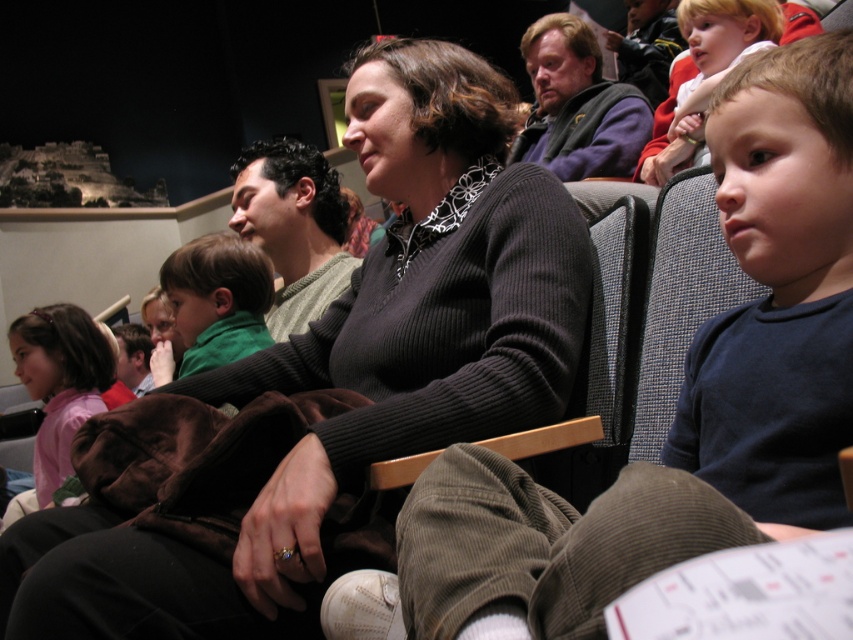
Based on the photo, is black ribbed sweater at center to the left of blonde hair child at center from the viewer's perspective?

Indeed, black ribbed sweater at center is positioned on the left side of blonde hair child at center.

Does black ribbed sweater at center have a larger size compared to blonde hair child at center?

Yes, black ribbed sweater at center is bigger than blonde hair child at center.

The height and width of the screenshot is (640, 853). In order to click on black ribbed sweater at center in this screenshot , I will do `click(352, 368)`.

Is pink fabric shirt at lower left positioned in front of blonde hair child at center?

No, pink fabric shirt at lower left is behind blonde hair child at center.

Is pink fabric shirt at lower left to the left of blonde hair child at center from the viewer's perspective?

Yes, pink fabric shirt at lower left is to the left of blonde hair child at center.

Measure the distance between pink fabric shirt at lower left and camera.

pink fabric shirt at lower left and camera are 8.64 feet apart from each other.

Find the location of a particular element. pink fabric shirt at lower left is located at coordinates (59, 381).

Is green sweater at center to the left of pink fabric shirt at lower left from the viewer's perspective?

In fact, green sweater at center is to the right of pink fabric shirt at lower left.

Is point (323, 275) behind point (59, 365)?

No.

Is point (323, 285) closer to viewer compared to point (71, 310)?

Yes.

The width and height of the screenshot is (853, 640). What are the coordinates of `green sweater at center` in the screenshot? It's located at (293, 227).